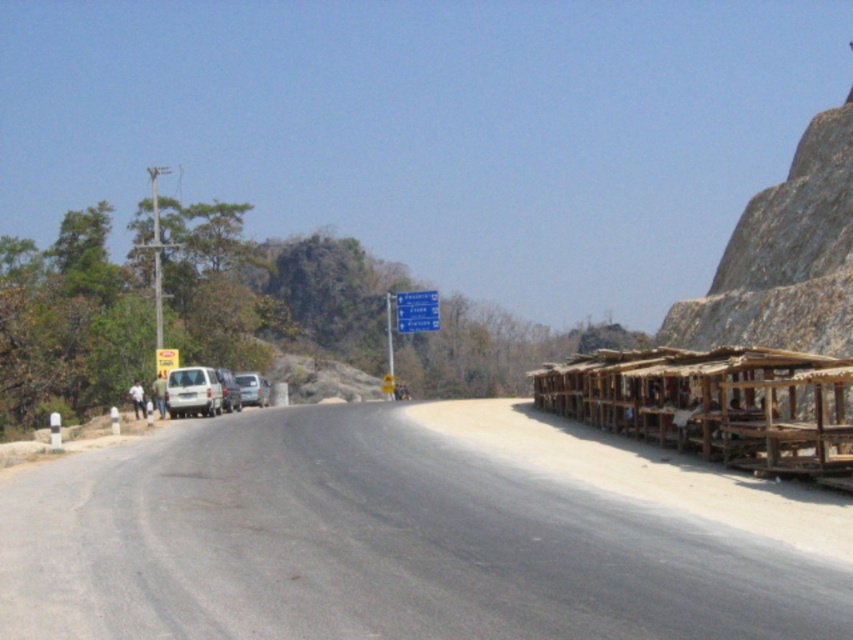
Can you confirm if smooth asphalt road at center is bigger than white matte van at center?

Incorrect, smooth asphalt road at center is not larger than white matte van at center.

Does smooth asphalt road at center have a greater height compared to white matte van at center?

No.

Does point (109, 492) come behind point (239, 396)?

No, it is not.

Identify the location of smooth asphalt road at center. The height and width of the screenshot is (640, 853). (375, 545).

Which of these two, brown wooden shelter at right or white matte van at center, stands taller?

brown wooden shelter at right is taller.

Does point (846, 474) lie in front of point (223, 406)?

Yes, it is.

Where is `brown wooden shelter at right`? The height and width of the screenshot is (640, 853). brown wooden shelter at right is located at coordinates (715, 404).

Is smooth asphalt road at center closer to the viewer compared to brown wooden shelter at right?

Yes.

From the picture: Is smooth asphalt road at center above brown wooden shelter at right?

Actually, smooth asphalt road at center is below brown wooden shelter at right.

Where is `smooth asphalt road at center`? Image resolution: width=853 pixels, height=640 pixels. smooth asphalt road at center is located at coordinates (375, 545).

Identify the location of smooth asphalt road at center. This screenshot has width=853, height=640. (375, 545).